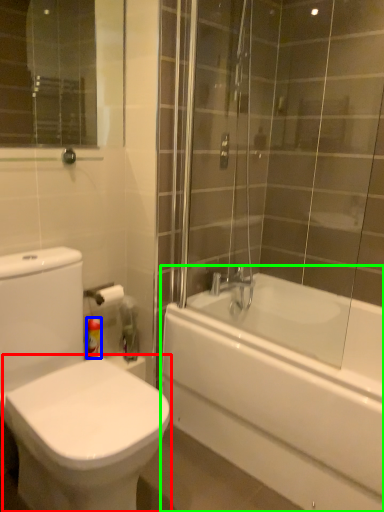
Question: Which is farther away from bidet (highlighted by a red box)? toiletry (highlighted by a blue box) or bathtub (highlighted by a green box)?

Choices:
 (A) toiletry
 (B) bathtub

Answer: (B)